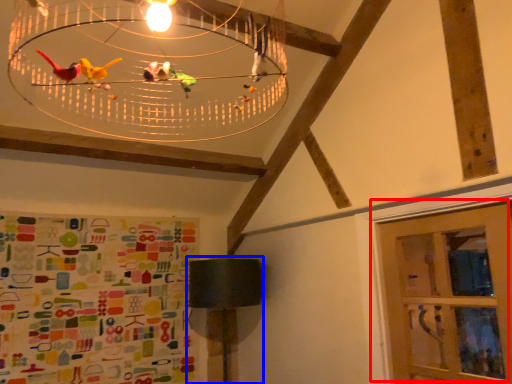
Question: Which point is further to the camera, door (highlighted by a red box) or table lamp (highlighted by a blue box)?

Choices:
 (A) door
 (B) table lamp

Answer: (B)